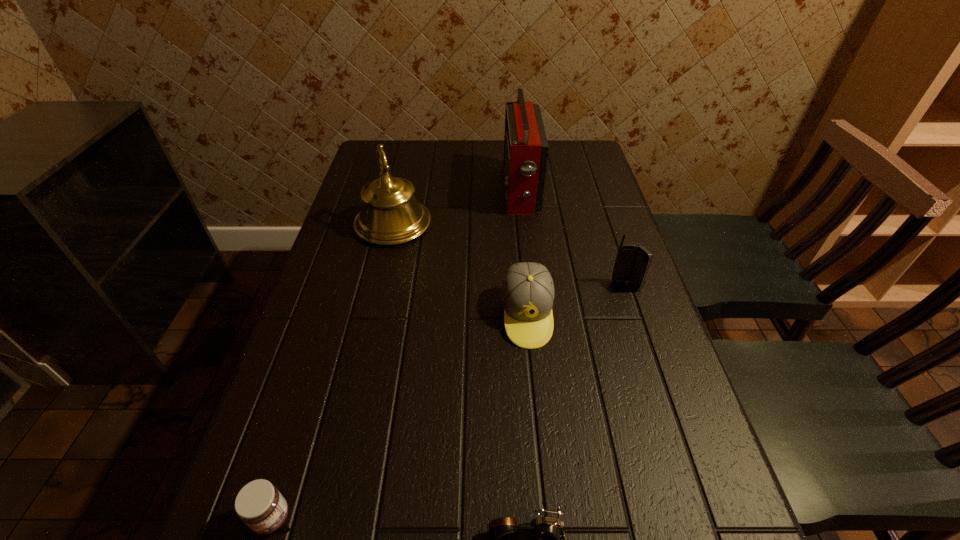
Locate an element on the screen. The image size is (960, 540). free region located 0.390m on the keyboard of the rightmost object is located at coordinates (684, 455).

You are a GUI agent. You are given a task and a screenshot of the screen. Output one action in this format:
    pyautogui.click(x=<x>, y=<y>)
    Task: Click on the vacant area located on the front-facing side of the fourth tallest object
    The image size is (960, 540).
    Given the screenshot: What is the action you would take?
    pyautogui.click(x=535, y=387)

Identify the location of object that is at the far edge. The image size is (960, 540). (526, 147).

The image size is (960, 540). I want to click on bell that is positioned at the left edge, so click(390, 215).

Locate an element on the screen. The width and height of the screenshot is (960, 540). jam present at the left edge is located at coordinates click(x=259, y=504).

The image size is (960, 540). What are the coordinates of `object that is at the right edge` in the screenshot? It's located at 632,263.

Find the location of `blank space at the far edge of the desktop`. blank space at the far edge of the desktop is located at coordinates (473, 164).

In the image, there is a desktop. In order to click on vacant space at the left edge in this screenshot , I will do `click(369, 268)`.

In the image, there is a desktop. What are the coordinates of `vacant region at the right edge` in the screenshot? It's located at (591, 220).

The image size is (960, 540). I want to click on free space at the far right corner of the desktop, so click(572, 164).